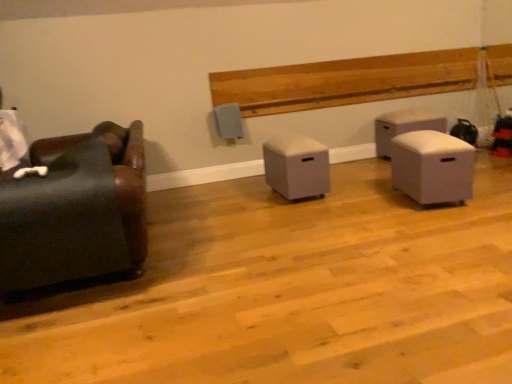
Question: Considering the relative sizes of white fabric ottoman at right, which is the 2th furniture in right-to-left order, and white fabric ottoman at right, which is the 1th furniture from back to front, in the image provided, is white fabric ottoman at right, which is the 2th furniture in right-to-left order, smaller than white fabric ottoman at right, which is the 1th furniture from back to front,?

Choices:
 (A) no
 (B) yes

Answer: (B)

Question: Does white fabric ottoman at right, acting as the third furniture starting from the left, have a greater height compared to white fabric ottoman at right, the fourth furniture positioned from the left?

Choices:
 (A) no
 (B) yes

Answer: (A)

Question: Is white fabric ottoman at right, which is the 2th furniture in right-to-left order, positioned behind white fabric ottoman at right, the fourth furniture positioned from the left?

Choices:
 (A) yes
 (B) no

Answer: (B)

Question: Is there a large distance between white fabric ottoman at right, the second furniture positioned from the front, and white fabric ottoman at right, the 1th furniture in the right-to-left sequence?

Choices:
 (A) yes
 (B) no

Answer: (A)

Question: Is white fabric ottoman at right, the second furniture positioned from the front, thinner than white fabric ottoman at right, the 1th furniture in the right-to-left sequence?

Choices:
 (A) yes
 (B) no

Answer: (A)

Question: Is white fabric ottoman at right, acting as the third furniture starting from the left, bigger than white fabric ottoman at right, which appears as the fourth furniture when viewed from the front?

Choices:
 (A) yes
 (B) no

Answer: (B)

Question: Considering the relative positions of white fabric ottoman at right, the 1th furniture in the right-to-left sequence, and leather couch at left, the 4th furniture viewed from the right, in the image provided, is white fabric ottoman at right, the 1th furniture in the right-to-left sequence, behind leather couch at left, the 4th furniture viewed from the right,?

Choices:
 (A) yes
 (B) no

Answer: (A)

Question: Does white fabric ottoman at right, the fourth furniture positioned from the left, have a smaller size compared to leather couch at left, the 4th furniture viewed from the right?

Choices:
 (A) no
 (B) yes

Answer: (B)

Question: Is white fabric ottoman at right, the 1th furniture in the right-to-left sequence, positioned with its back to leather couch at left, the 4th furniture viewed from the right?

Choices:
 (A) yes
 (B) no

Answer: (B)

Question: From the image's perspective, does white fabric ottoman at right, the fourth furniture positioned from the left, appear lower than leather couch at left, the 4th furniture viewed from the right?

Choices:
 (A) no
 (B) yes

Answer: (A)

Question: Can we say white fabric ottoman at right, the fourth furniture positioned from the left, lies outside leather couch at left, which is the first furniture in left-to-right order?

Choices:
 (A) no
 (B) yes

Answer: (B)

Question: Would you say leather couch at left, which is the first furniture in left-to-right order, is part of white fabric ottoman at right, the fourth furniture positioned from the left,'s contents?

Choices:
 (A) no
 (B) yes

Answer: (A)

Question: Does white fabric ottoman at right, the fourth furniture positioned from the left, contain beige fabric ottoman at center, which appears as the second furniture when viewed from the back?

Choices:
 (A) no
 (B) yes

Answer: (A)